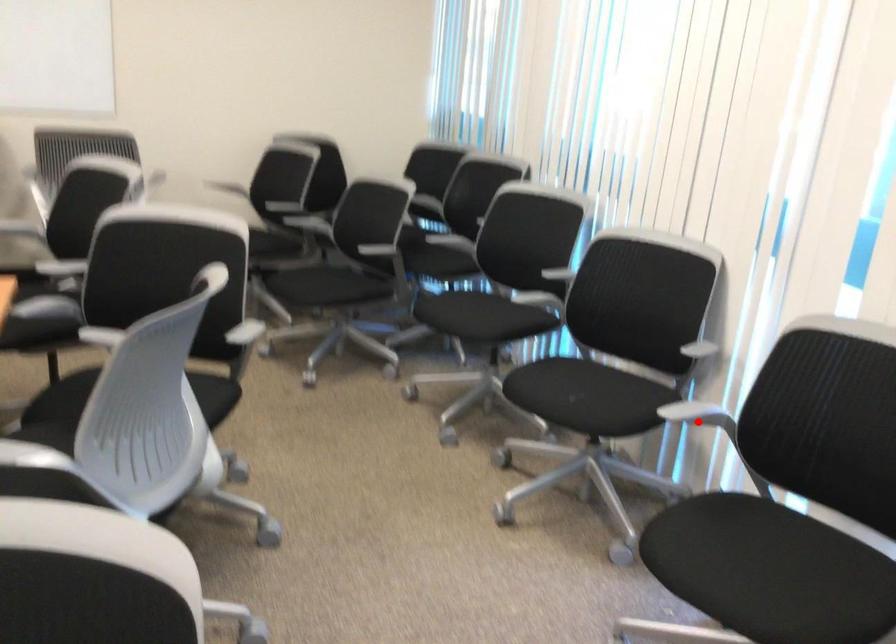
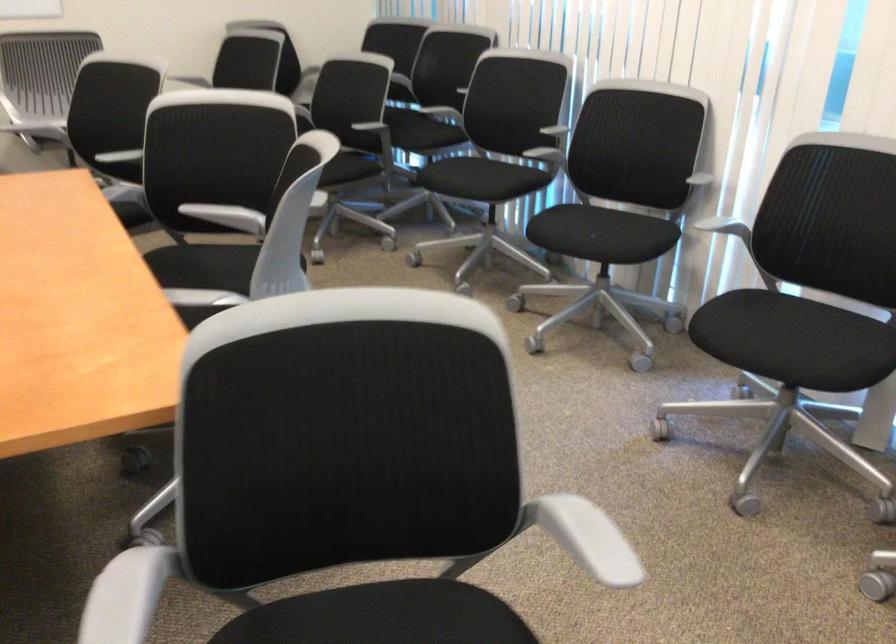
Find the pixel in the second image that matches the highlighted location in the first image.

(725, 228)